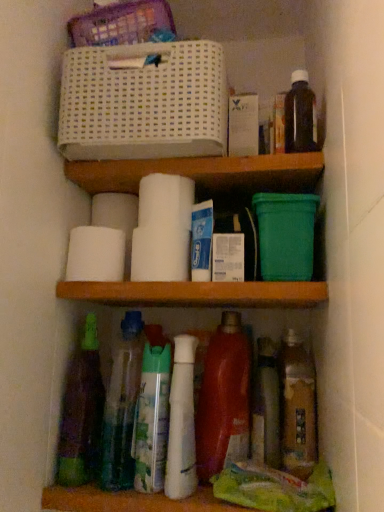
Question: Is white matte toilet paper at center, the 3th toilet paper viewed from the back, touching translucent plastic bottles at center, marked as the seventh bottle in a right-to-left arrangement?

Choices:
 (A) no
 (B) yes

Answer: (A)

Question: Is translucent plastic bottles at center, marked as the seventh bottle in a right-to-left arrangement, located within white matte toilet paper at center, the second toilet paper viewed from the front?

Choices:
 (A) yes
 (B) no

Answer: (B)

Question: Is white matte toilet paper at center, the 3th toilet paper viewed from the back, located outside translucent plastic bottles at center, the second bottle when ordered from left to right?

Choices:
 (A) yes
 (B) no

Answer: (A)

Question: Is white matte toilet paper at center, the 3th toilet paper viewed from the back, at the left side of translucent plastic bottles at center, marked as the seventh bottle in a right-to-left arrangement?

Choices:
 (A) no
 (B) yes

Answer: (B)

Question: Is white matte toilet paper at center, the second toilet paper viewed from the front, oriented towards translucent plastic bottles at center, marked as the seventh bottle in a right-to-left arrangement?

Choices:
 (A) no
 (B) yes

Answer: (A)

Question: From the image's perspective, is translucent plastic spray bottle at lower center, positioned as the 6th bottle in right-to-left order, above or below white matte toilet paper at center, the second toilet paper viewed from the front?

Choices:
 (A) above
 (B) below

Answer: (B)

Question: Do you think translucent plastic spray bottle at lower center, positioned as the 6th bottle in right-to-left order, is within white matte toilet paper at center, the second toilet paper viewed from the front, or outside of it?

Choices:
 (A) outside
 (B) inside

Answer: (A)

Question: Considering their positions, is translucent plastic spray bottle at lower center, positioned as the 6th bottle in right-to-left order, located in front of or behind white matte toilet paper at center, the 3th toilet paper viewed from the back?

Choices:
 (A) front
 (B) behind

Answer: (A)

Question: Is point (157, 473) positioned closer to the camera than point (107, 250)?

Choices:
 (A) closer
 (B) farther

Answer: (A)

Question: Do you think white glossy bottle at center, which is counted as the fourth bottle, starting from the left, is within shiny red plastic bottle at lower center, marked as the fourth bottle in a right-to-left arrangement, or outside of it?

Choices:
 (A) inside
 (B) outside

Answer: (B)

Question: Is white glossy bottle at center, the fifth bottle viewed from the right, wider or thinner than shiny red plastic bottle at lower center, the 5th bottle when ordered from left to right?

Choices:
 (A) thin
 (B) wide

Answer: (B)

Question: Considering their positions, is white glossy bottle at center, which is counted as the fourth bottle, starting from the left, located in front of or behind shiny red plastic bottle at lower center, the 5th bottle when ordered from left to right?

Choices:
 (A) behind
 (B) front

Answer: (B)

Question: Does point (195, 458) appear closer or farther from the camera than point (220, 389)?

Choices:
 (A) closer
 (B) farther

Answer: (A)

Question: In the image, is translucent plastic bottles at center, marked as the seventh bottle in a right-to-left arrangement, on the left side or the right side of white matte toilet paper at center, which is the 1th toilet paper in front-to-back order?

Choices:
 (A) right
 (B) left

Answer: (B)

Question: Considering the positions of point (122, 426) and point (168, 275), is point (122, 426) closer or farther from the camera than point (168, 275)?

Choices:
 (A) farther
 (B) closer

Answer: (A)